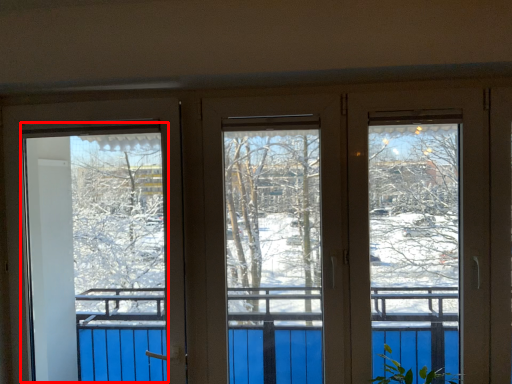
Question: From the image's perspective, what is the correct spatial positioning of screen door (annotated by the red box) in reference to plant?

Choices:
 (A) above
 (B) below

Answer: (A)